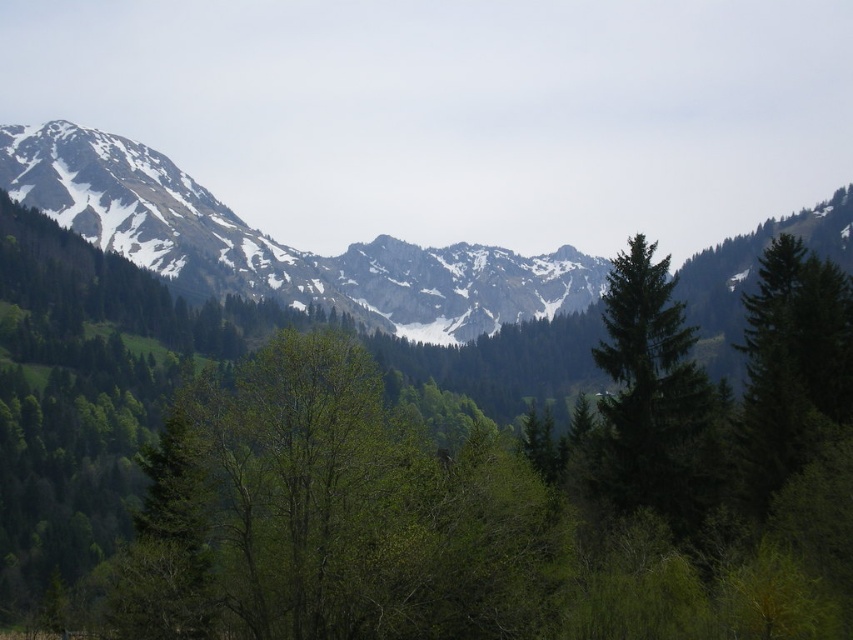
Question: Which point appears farthest from the camera in this image?

Choices:
 (A) (44, 188)
 (B) (786, 486)
 (C) (685, 512)

Answer: (A)

Question: Estimate the real-world distances between objects in this image. Which object is farther from the green leafy tree at center?

Choices:
 (A) green matte tree at center
 (B) snowy rock mountain range at left

Answer: (B)

Question: Can you confirm if green leafy tree at center is positioned above green matte tree at center?

Choices:
 (A) no
 (B) yes

Answer: (A)

Question: Observing the image, what is the correct spatial positioning of snowy rock mountain range at left in reference to green matte tree at center?

Choices:
 (A) below
 (B) above

Answer: (B)

Question: Among these points, which one is farthest from the camera?

Choices:
 (A) (260, 356)
 (B) (53, 218)
 (C) (610, 298)

Answer: (B)

Question: Can you confirm if snowy rock mountain range at left is wider than green matte tree at center?

Choices:
 (A) no
 (B) yes

Answer: (B)